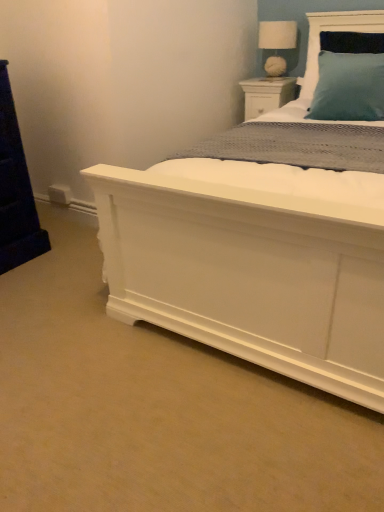
Question: Is white wood nightstand at upper right inside white fabric lampshade at upper center?

Choices:
 (A) yes
 (B) no

Answer: (B)

Question: From the image's perspective, is white fabric lampshade at upper center located above white wood nightstand at upper right?

Choices:
 (A) no
 (B) yes

Answer: (B)

Question: Is white fabric lampshade at upper center closer to the viewer compared to white wood nightstand at upper right?

Choices:
 (A) yes
 (B) no

Answer: (A)

Question: Is white fabric lampshade at upper center shorter than white wood nightstand at upper right?

Choices:
 (A) yes
 (B) no

Answer: (B)

Question: Can you confirm if white fabric lampshade at upper center is positioned to the left of white wood nightstand at upper right?

Choices:
 (A) yes
 (B) no

Answer: (B)

Question: From the image's perspective, does white fabric lampshade at upper center appear lower than white wood nightstand at upper right?

Choices:
 (A) no
 (B) yes

Answer: (A)

Question: From a real-world perspective, is white wood nightstand at upper right positioned over white fabric lampshade at upper center based on gravity?

Choices:
 (A) no
 (B) yes

Answer: (A)

Question: Considering the relative sizes of white wood nightstand at upper right and white fabric lampshade at upper center in the image provided, is white wood nightstand at upper right shorter than white fabric lampshade at upper center?

Choices:
 (A) yes
 (B) no

Answer: (A)

Question: Are white wood nightstand at upper right and white fabric lampshade at upper center beside each other?

Choices:
 (A) yes
 (B) no

Answer: (B)

Question: Can white fabric lampshade at upper center be found inside white wood nightstand at upper right?

Choices:
 (A) yes
 (B) no

Answer: (B)

Question: From the image's perspective, does white wood nightstand at upper right appear lower than white fabric lampshade at upper center?

Choices:
 (A) yes
 (B) no

Answer: (A)

Question: Could you tell me if white wood nightstand at upper right is turned towards white fabric lampshade at upper center?

Choices:
 (A) yes
 (B) no

Answer: (B)

Question: Considering their positions, is white wood nightstand at upper right located in front of or behind white fabric lampshade at upper center?

Choices:
 (A) behind
 (B) front

Answer: (A)